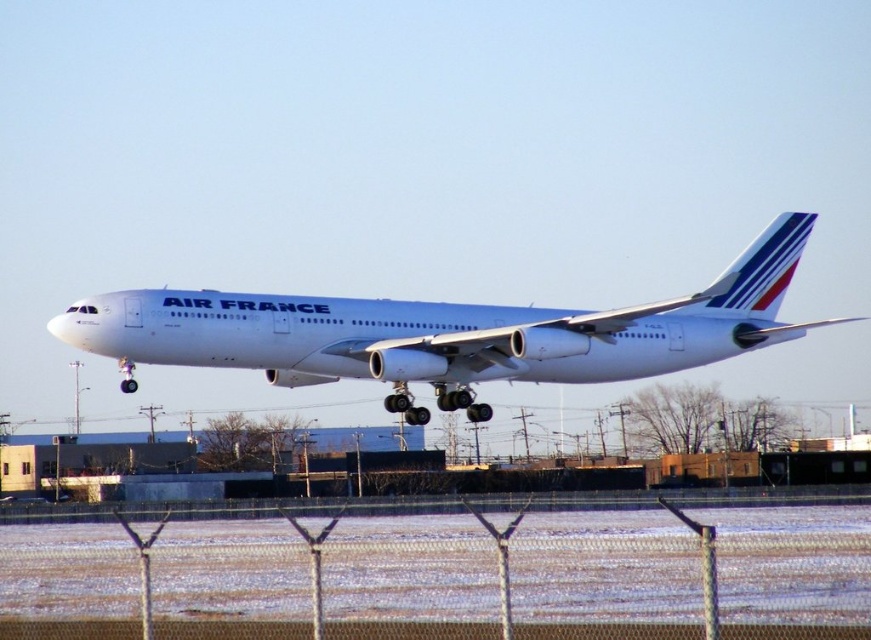
You are a pilot observing an Air France aircraft during landing. There is a metallic chain link fence at lower center represented by point (520, 576). Can you determine if the fence is closer to the aircraft than the runway?

The metallic chain link fence at lower center is represented by point (520, 576). Since the fence is at lower center, it is likely positioned near the edge of the runway or adjacent to it. However, without specific distance data between the fence and the runway, we cannot definitively determine if it is closer to the aircraft than the runway itself. The answer is inconclusive based on the provided information.